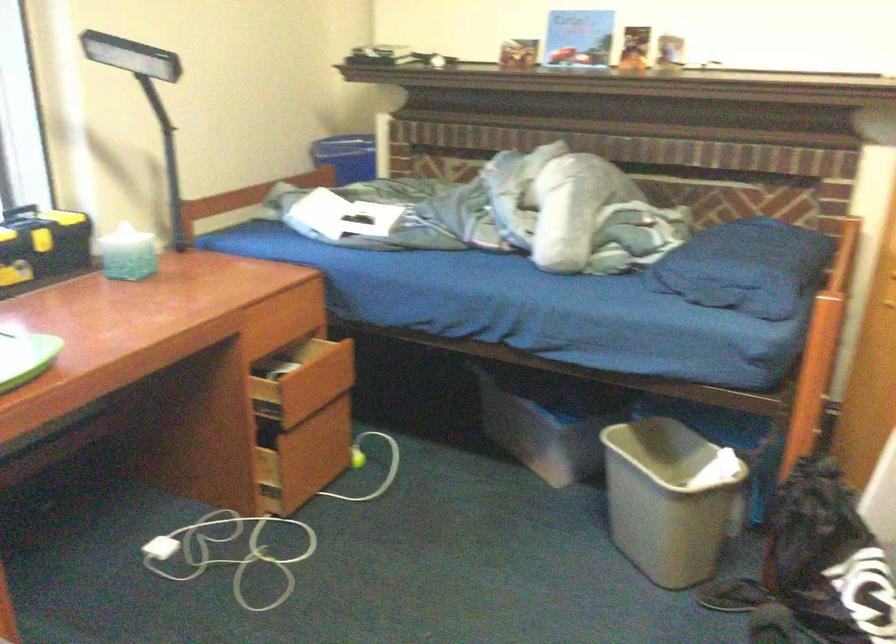
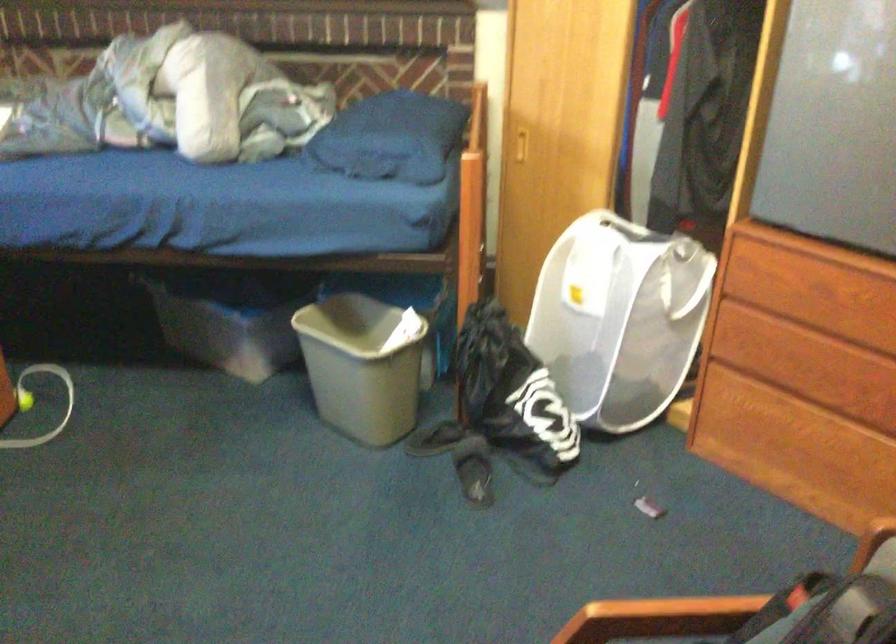
Question: Which direction would the cameraman need to move to produce the second image? Reply with the corresponding letter.

Choices:
 (A) Left
 (B) Right
 (C) Forward
 (D) Backward

Answer: (A)